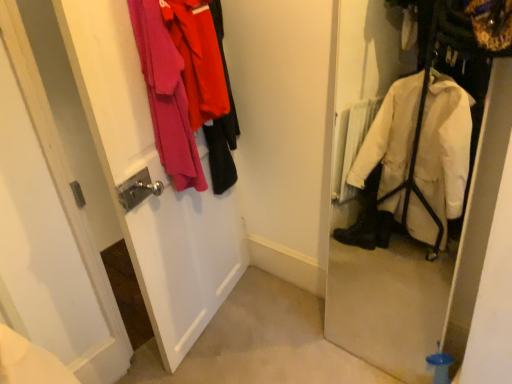
Identify the location of white matte door at left. The width and height of the screenshot is (512, 384). (152, 180).

What do you see at coordinates (152, 180) in the screenshot? Image resolution: width=512 pixels, height=384 pixels. I see `white matte door at left` at bounding box center [152, 180].

What is the approximate width of velvet pink coat at left?

The width of velvet pink coat at left is 23.89 centimeters.

This screenshot has width=512, height=384. What are the coordinates of `velvet pink coat at left` in the screenshot? It's located at pos(186,88).

What do you see at coordinates (186, 88) in the screenshot?
I see `velvet pink coat at left` at bounding box center [186, 88].

Find the location of a particular element. This screenshot has height=384, width=512. white matte door at left is located at coordinates (152, 180).

In the image, is velvet pink coat at left on the left side or the right side of white matte door at left?

Based on their positions, velvet pink coat at left is located to the right of white matte door at left.

Which object is closer to the camera taking this photo, velvet pink coat at left or white matte door at left?

Positioned in front is white matte door at left.

Is point (152, 85) closer or farther from the camera than point (230, 231)?

Point (152, 85) is positioned closer to the camera compared to point (230, 231).

From the image's perspective, is velvet pink coat at left above or below white matte door at left?

Based on their image positions, velvet pink coat at left is located above white matte door at left.

From a real-world perspective, is velvet pink coat at left physically located above or below white matte door at left?

In terms of real-world spatial position, velvet pink coat at left is above white matte door at left.

Which object is thinner, velvet pink coat at left or white matte door at left?

Thinner between the two is white matte door at left.

Looking at this image, is velvet pink coat at left taller or shorter than white matte door at left?

Clearly, velvet pink coat at left is shorter compared to white matte door at left.

Can you confirm if velvet pink coat at left is bigger than white matte door at left?

Actually, velvet pink coat at left might be smaller than white matte door at left.

Is velvet pink coat at left outside of white matte door at left?

No, velvet pink coat at left is inside white matte door at left's boundary.

Are velvet pink coat at left and white matte door at left far apart?

velvet pink coat at left is near white matte door at left, not far away.

Is velvet pink coat at left looking in the opposite direction of white matte door at left?

No, velvet pink coat at left is not facing the opposite direction of white matte door at left.

How many degrees apart are the facing directions of velvet pink coat at left and white matte door at left?

91.8 degrees separate the facing orientations of velvet pink coat at left and white matte door at left.

This screenshot has height=384, width=512. What are the coordinates of `screen door in front of the velvet pink coat at left` in the screenshot? It's located at (152, 180).

Based on the photo, does white matte door at left appear on the left side of velvet pink coat at left?

Yes.

Which object is further away from the camera, white matte door at left or velvet pink coat at left?

velvet pink coat at left is further away from the camera.

Is point (145, 258) behind point (142, 7)?

That is True.

From the image's perspective, is white matte door at left located above or below velvet pink coat at left?

Clearly, from the image's perspective, white matte door at left is below velvet pink coat at left.

From a real-world perspective, is white matte door at left located beneath velvet pink coat at left?

Indeed, from a real-world perspective, white matte door at left is positioned beneath velvet pink coat at left.

Based on the photo, considering the relative sizes of white matte door at left and velvet pink coat at left in the image provided, is white matte door at left thinner than velvet pink coat at left?

Correct, the width of white matte door at left is less than that of velvet pink coat at left.

Does white matte door at left have a greater height compared to velvet pink coat at left?

Indeed, white matte door at left has a greater height compared to velvet pink coat at left.

Consider the image. Does white matte door at left have a larger size compared to velvet pink coat at left?

Yes.

Can velvet pink coat at left be found inside white matte door at left?

Yes, velvet pink coat at left is inside white matte door at left.

Is there a large distance between white matte door at left and velvet pink coat at left?

No, white matte door at left is not far away from velvet pink coat at left.

Is white matte door at left aimed at velvet pink coat at left?

Yes, white matte door at left is aimed at velvet pink coat at left.

Can you tell me how much white matte door at left and velvet pink coat at left differ in facing direction?

They differ by 91.8 degrees in their facing directions.

You are a GUI agent. You are given a task and a screenshot of the screen. Output one action in this format:
    pyautogui.click(x=<x>, y=<y>)
    Task: Click on the laundry located behind the white matte door at left
    The width and height of the screenshot is (512, 384).
    Given the screenshot: What is the action you would take?
    pyautogui.click(x=186, y=88)

Identify the location of screen door below the velvet pink coat at left (from a real-world perspective). (152, 180).

Where is `screen door on the left of velvet pink coat at left`? screen door on the left of velvet pink coat at left is located at coordinates (152, 180).